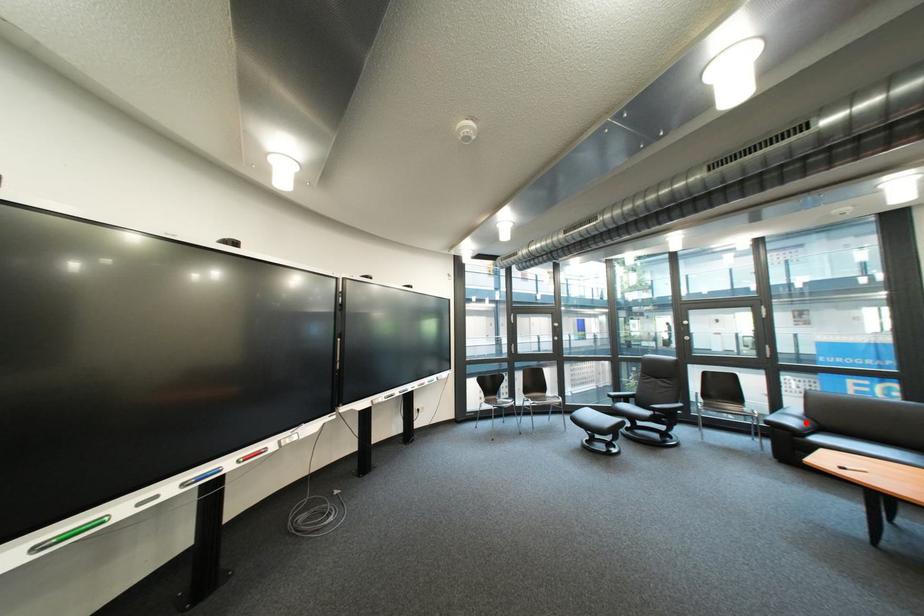
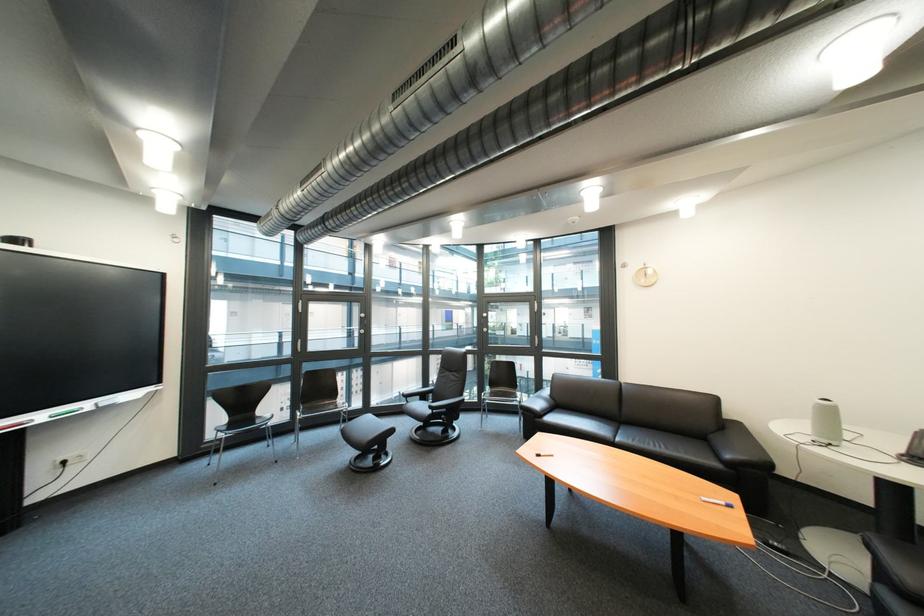
Where in the second image is the point corresponding to the highlighted location from the first image?

(551, 406)